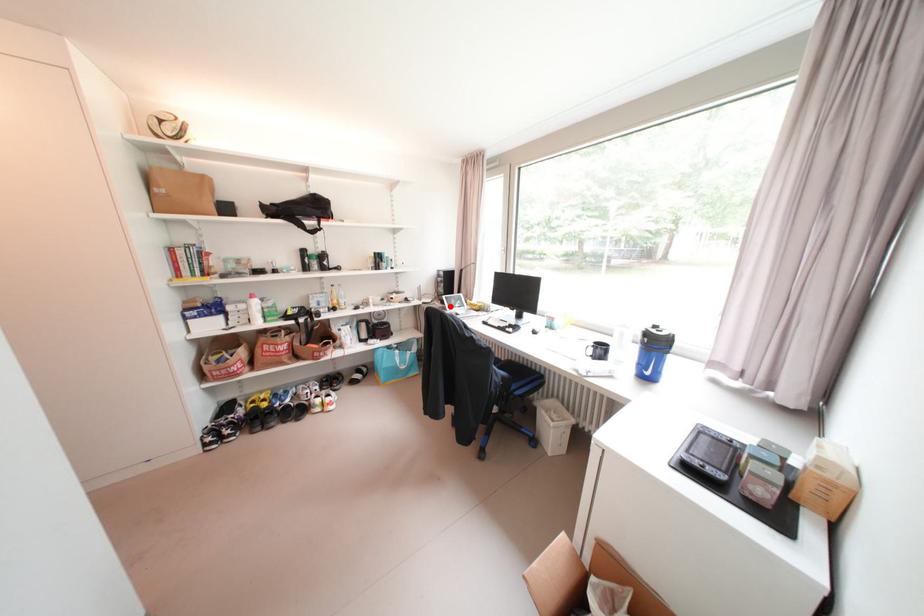
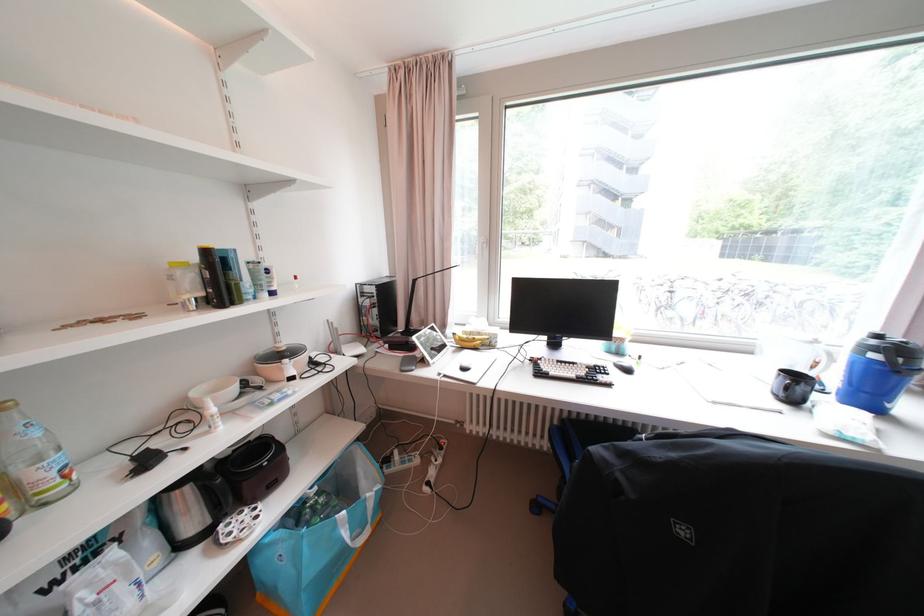
Where in the second image is the point corresponding to the highlighted location from the first image?

(409, 355)